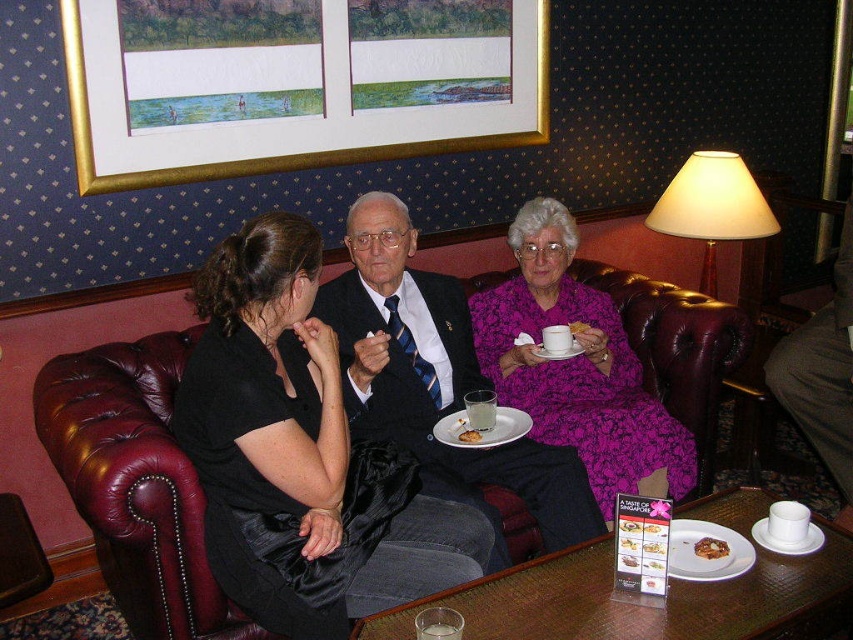
You are a photographer setting up for a photoshoot in the living room. You have a purple floral dress at center and a translucent glass at center in the scene. Which object is covering the other one?

The purple floral dress at center is positioned over the translucent glass at center, so the dress is covering the glass.

You are a guest at this gathering and want to choose a beverage. Which object from the translucent glass at center and the smooth cream cupcake at upper center is smaller in size?

The translucent glass at center has a smaller size compared to the smooth cream cupcake at upper center, so the translucent glass at center is the smaller one.